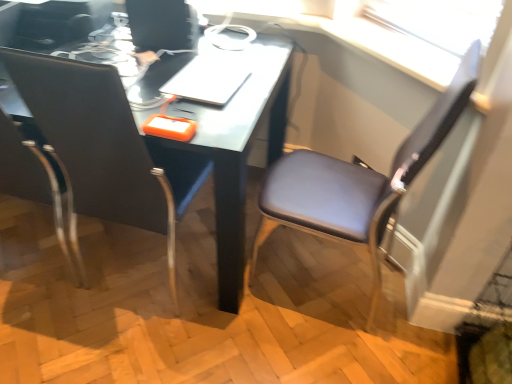
This screenshot has height=384, width=512. In order to click on free space to the left of matte black chair at right, the 1th chair when ordered from right to left in this screenshot , I will do `click(231, 305)`.